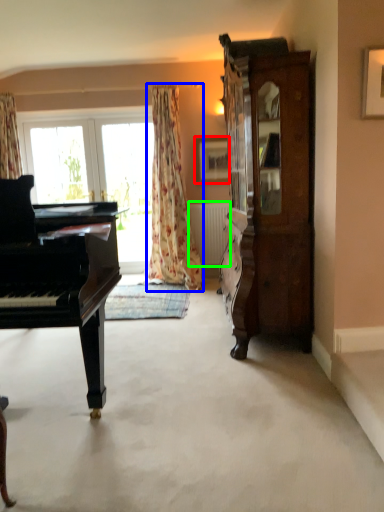
Question: Based on their relative distances, which object is nearer to picture frame (highlighted by a red box)? Choose from curtain (highlighted by a blue box) and radiator (highlighted by a green box).

Choices:
 (A) curtain
 (B) radiator

Answer: (A)